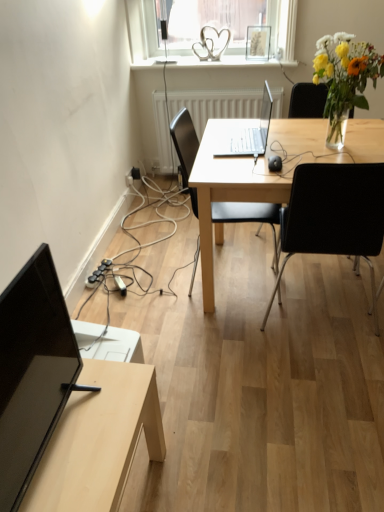
At what (x,y) coordinates should I click in order to perform the action: click on free space in front of light wood desk at center. Please return your answer as a coordinate pair (x, y). Looking at the image, I should click on (278, 398).